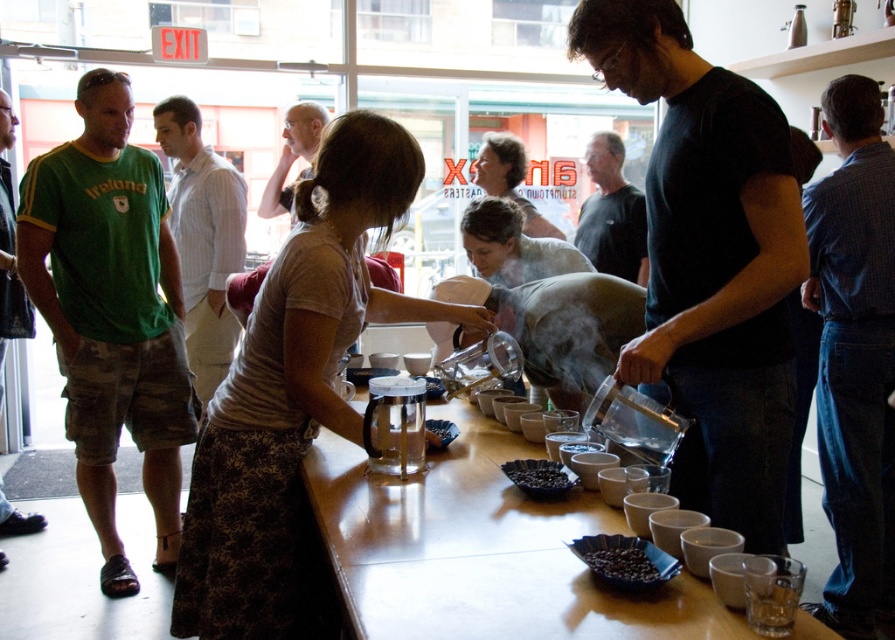
Question: Which object is farther from the camera taking this photo?

Choices:
 (A) black t-shirt at center
 (B) smooth gray shirt at center

Answer: (A)

Question: Which of these objects is positioned closest to the black t-shirt at center?

Choices:
 (A) dark matte coffee beans at center
 (B) black matte coffee beans at center

Answer: (B)

Question: Can you confirm if black matte pitcher at center is positioned below wooden table at center?

Choices:
 (A) no
 (B) yes

Answer: (A)

Question: Which point is closer to the camera?

Choices:
 (A) (866, 212)
 (B) (739, 513)
 (C) (595, 172)
 (D) (10, 292)

Answer: (B)

Question: Is white striped shirt at left bigger than green cotton t-shirt at left?

Choices:
 (A) no
 (B) yes

Answer: (A)

Question: Can you confirm if dark matte coffee beans at center is positioned to the right of black matte coffee beans at center?

Choices:
 (A) no
 (B) yes

Answer: (B)